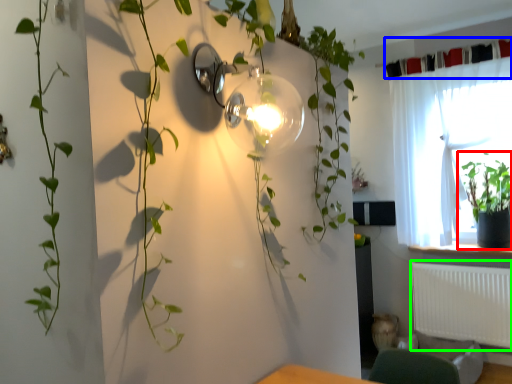
Question: Which is nearer to the houseplant (highlighted by a red box)? curtain (highlighted by a blue box) or radiator (highlighted by a green box).

Choices:
 (A) curtain
 (B) radiator

Answer: (B)